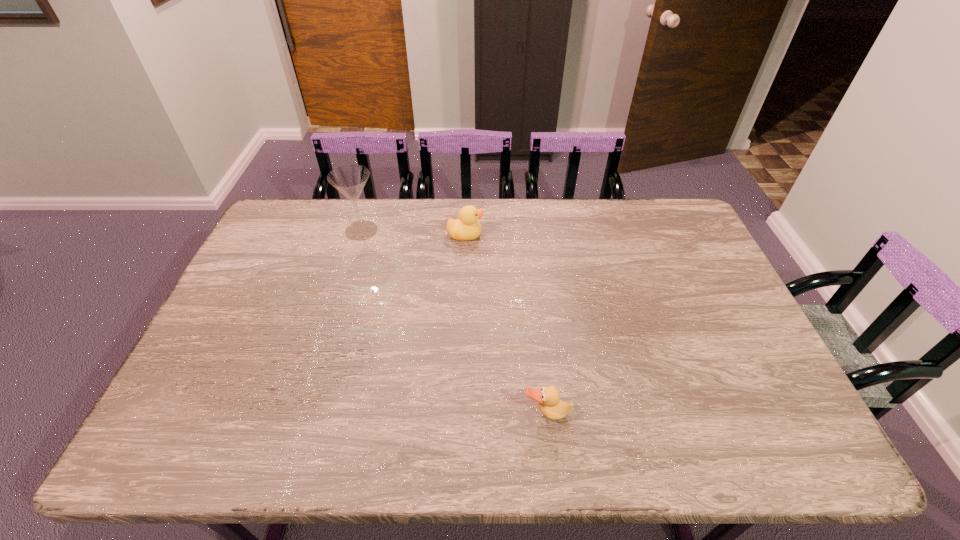
Where is `vacant area between the leftmost object and the farther duck`? The height and width of the screenshot is (540, 960). vacant area between the leftmost object and the farther duck is located at coordinates (414, 233).

Where is `free space between the flute glass and the second object from right to left`? This screenshot has height=540, width=960. free space between the flute glass and the second object from right to left is located at coordinates (414, 233).

Image resolution: width=960 pixels, height=540 pixels. Find the location of `empty space between the left duck and the tallest object`. empty space between the left duck and the tallest object is located at coordinates [414, 233].

Locate an element on the screen. The height and width of the screenshot is (540, 960). free space between the flute glass and the rightmost object is located at coordinates (454, 322).

Locate an element on the screen. The height and width of the screenshot is (540, 960). free space between the second object from right to left and the leftmost object is located at coordinates (414, 233).

Locate an element on the screen. This screenshot has height=540, width=960. free space between the tallest object and the farther duck is located at coordinates (414, 233).

The image size is (960, 540). Identify the location of empty space between the rightmost object and the flute glass. (454, 322).

I want to click on the second closest object to the rightmost object, so [x=349, y=180].

Point out which object is positioned as the nearest to the right duck. Please provide its 2D coordinates. Your answer should be formatted as a tuple, i.e. [(x, y)], where the tuple contains the x and y coordinates of a point satisfying the conditions above.

[(467, 227)]